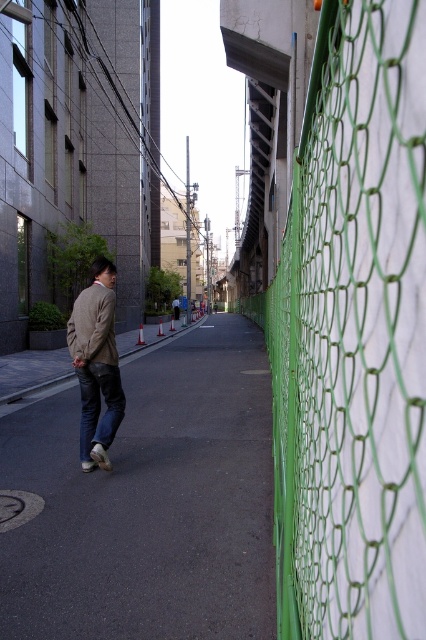
Question: Does green mesh fence at right appear over black asphalt pavement at center?

Choices:
 (A) yes
 (B) no

Answer: (A)

Question: Which object is the farthest from the beige woolen jacket at left?

Choices:
 (A) light brown textured blazer at center
 (B) green mesh fence at right

Answer: (B)

Question: Considering the relative positions of green mesh fence at right and black asphalt pavement at center in the image provided, where is green mesh fence at right located with respect to black asphalt pavement at center?

Choices:
 (A) above
 (B) below

Answer: (A)

Question: Which object appears closest to the camera in this image?

Choices:
 (A) jeans at center
 (B) beige woolen jacket at left
 (C) light brown textured blazer at center
 (D) black asphalt pavement at center

Answer: (D)

Question: Which object is positioned farthest from the black asphalt pavement at center?

Choices:
 (A) beige woolen jacket at left
 (B) light brown textured blazer at center
 (C) jeans at center

Answer: (A)

Question: Does green mesh fence at right appear on the left side of jeans at center?

Choices:
 (A) no
 (B) yes

Answer: (A)